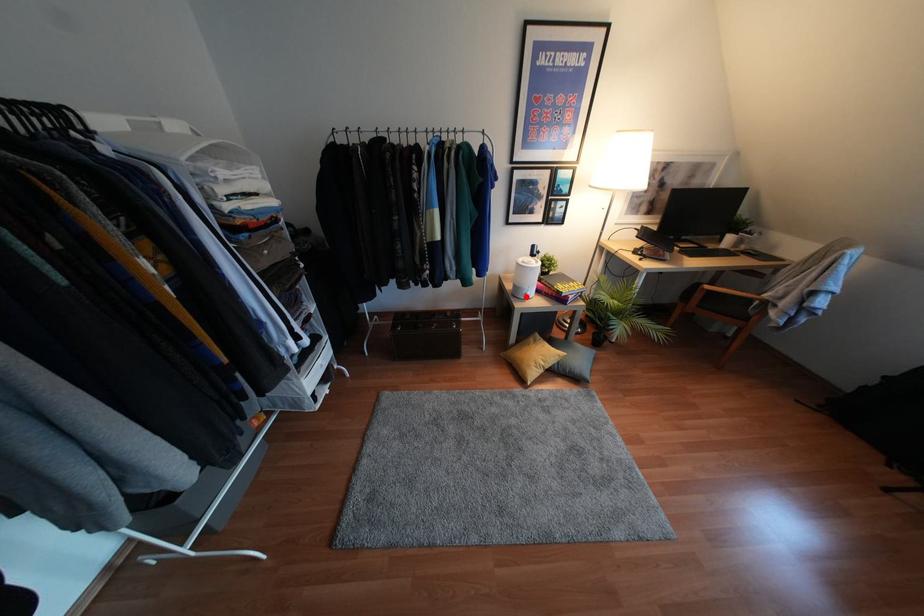
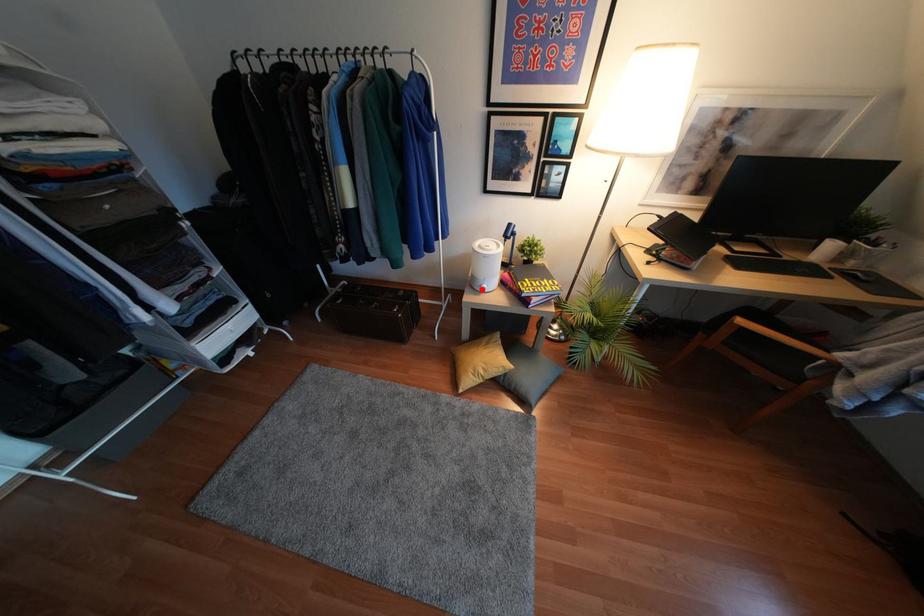
I am providing you with two images of the same scene from different viewpoints. A red point is marked on the first image and another point is marked on the second image. Is the red point in image1 aligned with the point shown in image2?

Yes